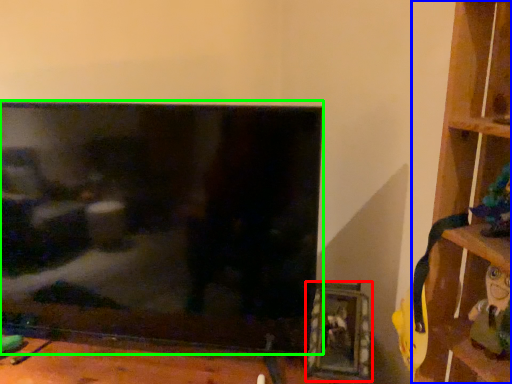
Question: Which object is positioned closest to picture frame (highlighted by a red box)? Select from shelf (highlighted by a blue box) and television (highlighted by a green box).

Choices:
 (A) shelf
 (B) television

Answer: (A)